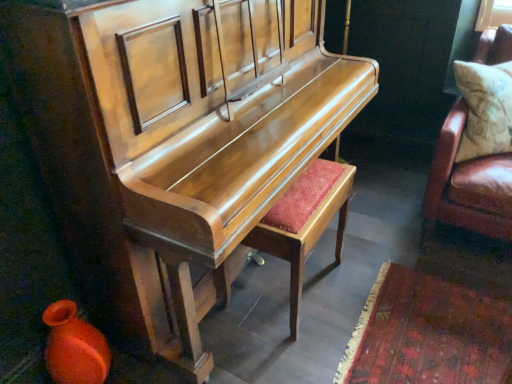
Identify the location of free spot to the right of shiny wood piano at center, which ranks as the first furniture in left-to-right order. (407, 264).